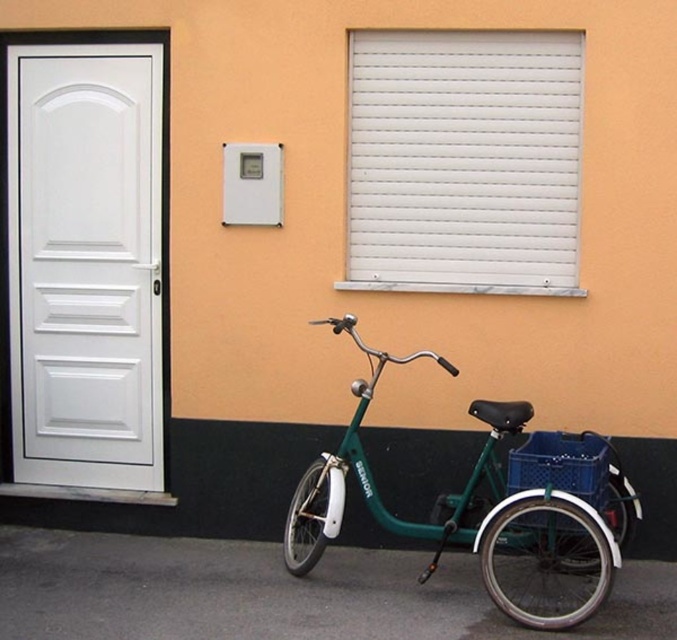
Question: From the image, what is the correct spatial relationship of white matte door at left in relation to green matte tricycle at lower right?

Choices:
 (A) right
 (B) left

Answer: (B)

Question: Which point is closer to the camera taking this photo?

Choices:
 (A) (334, 529)
 (B) (65, 120)

Answer: (A)

Question: Which point is farther to the camera?

Choices:
 (A) green matte tricycle at lower right
 (B) white matte door at left

Answer: (B)

Question: Is white matte door at left bigger than green matte tricycle at lower right?

Choices:
 (A) yes
 (B) no

Answer: (B)

Question: Is white matte door at left to the left of green matte tricycle at lower right from the viewer's perspective?

Choices:
 (A) no
 (B) yes

Answer: (B)